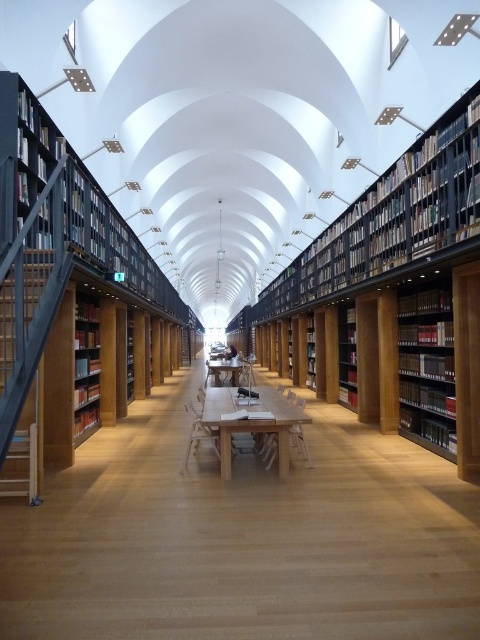
You are a student who needs to reach a book placed on the highest shelf of the matte black bookshelf at right. You have a ladder that is 1.8 meters tall. Can you safely reach the book if the wooden bookshelf at center is 1.5 meters tall?

The matte black bookshelf at right is located above the wooden bookshelf at center, which is 1.5 meters tall. Since the ladder is 1.8 meters tall, you can safely reach the book on the matte black bookshelf at right by standing on the ladder placed on top of the wooden bookshelf at center.

You are a student who needs to place a tall stack of books on the white wooden table at center. Considering the height of the table and the bookshelf, will the stack of books be visible from the corridor behind the wooden bookshelf at left?

The white wooden table at center has a lesser height compared to wooden bookshelf at left. Since the table is shorter, the stack of books placed on it may not be fully visible from behind the bookshelf, as the bookshelf is taller and could block the view.

You are a student carrying a large textbook. You want to place it on the surface that can accommodate its size. Which object between the white wooden table at center and the wooden bookshelf at left would be suitable?

The white wooden table at center has a larger size compared to the wooden bookshelf at left, so it can accommodate the large textbook.